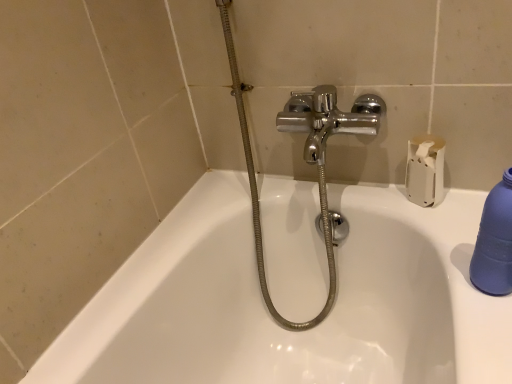
Question: Considering their positions, is white matte toilet paper at upper right located in front of or behind chrome metallic shower at center?

Choices:
 (A) front
 (B) behind

Answer: (B)

Question: Considering the positions of white matte toilet paper at upper right and chrome metallic shower at center in the image, is white matte toilet paper at upper right wider or thinner than chrome metallic shower at center?

Choices:
 (A) wide
 (B) thin

Answer: (B)

Question: Considering the real-world distances, which object is closest to the chrome metallic shower at center?

Choices:
 (A) blue matte bottle at right
 (B) white matte toilet paper at upper right

Answer: (B)

Question: Estimate the real-world distances between objects in this image. Which object is farther from the blue matte bottle at right?

Choices:
 (A) chrome metallic shower at center
 (B) white matte toilet paper at upper right

Answer: (A)